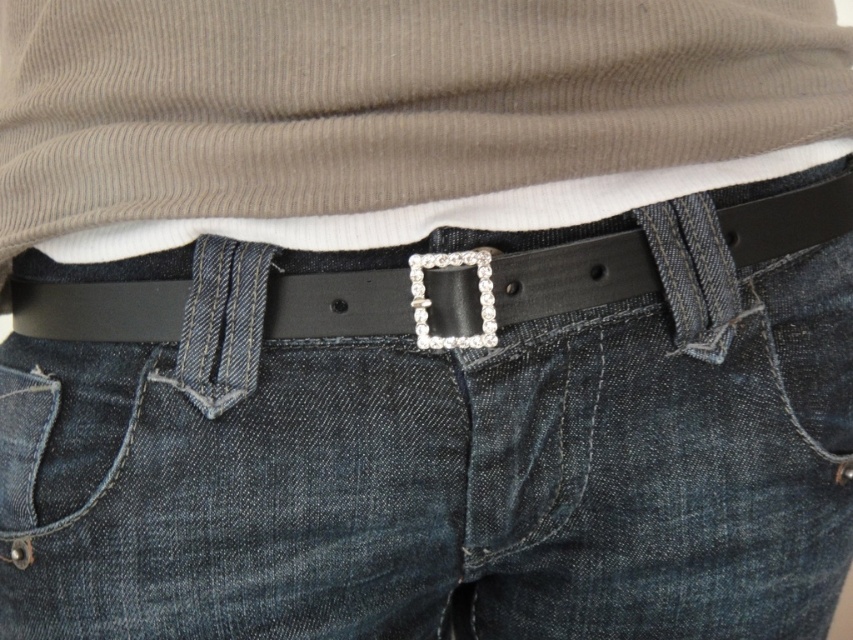
Can you confirm if matte brown ribbed shirt at center is taller than sparkly silver buckle at center?

Indeed, matte brown ribbed shirt at center has a greater height compared to sparkly silver buckle at center.

Measure the distance between matte brown ribbed shirt at center and camera.

30.32 inches

Describe the element at coordinates (386, 99) in the screenshot. I see `matte brown ribbed shirt at center` at that location.

Where is `matte brown ribbed shirt at center`? Image resolution: width=853 pixels, height=640 pixels. matte brown ribbed shirt at center is located at coordinates (386, 99).

Is the position of matte brown ribbed shirt at center more distant than that of black leather belt at center?

No, it is in front of black leather belt at center.

This screenshot has height=640, width=853. In order to click on matte brown ribbed shirt at center in this screenshot , I will do `click(386, 99)`.

In order to click on matte brown ribbed shirt at center in this screenshot , I will do `click(386, 99)`.

Between black leather belt at center and sparkly silver buckle at center, which one has more height?

black leather belt at center

Between black leather belt at center and sparkly silver buckle at center, which one is positioned higher?

black leather belt at center is above.

Measure the distance between black leather belt at center and camera.

black leather belt at center and camera are 83.86 centimeters apart from each other.

Where is `black leather belt at center`? The image size is (853, 640). black leather belt at center is located at coordinates (572, 276).